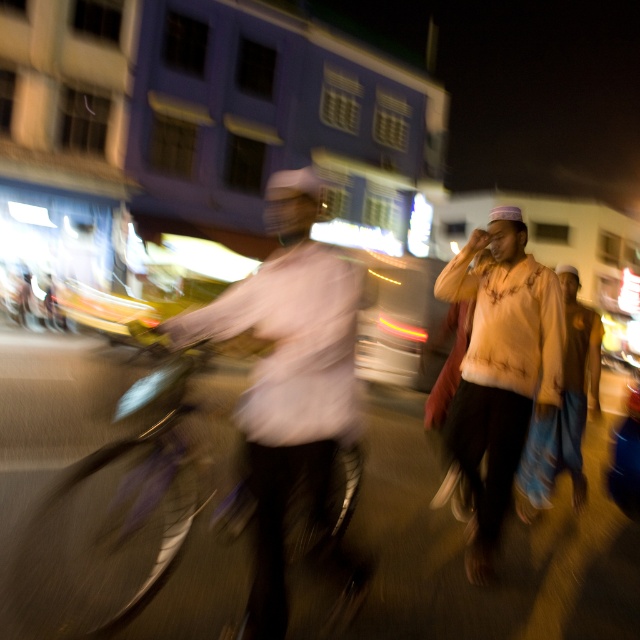
Does white matte shirt at center appear over light brown fabric shirt at center?

Yes.

Is white matte shirt at center to the right of light brown fabric shirt at center from the viewer's perspective?

Incorrect, white matte shirt at center is not on the right side of light brown fabric shirt at center.

Which is in front, point (308, 387) or point (536, 412)?

Point (308, 387) is in front.

The image size is (640, 640). In order to click on white matte shirt at center in this screenshot , I will do (x=291, y=392).

Between metallic silver bicycle at left and light brown fabric shirt at center, which one has more height?

light brown fabric shirt at center is taller.

Which is above, metallic silver bicycle at left or light brown fabric shirt at center?

light brown fabric shirt at center is above.

You are a GUI agent. You are given a task and a screenshot of the screen. Output one action in this format:
    pyautogui.click(x=<x>, y=<y>)
    Task: Click on the metallic silver bicycle at left
    
    Given the screenshot: What is the action you would take?
    pyautogui.click(x=128, y=512)

Is metallic silver bicycle at left below white matte shirt at center?

Yes, metallic silver bicycle at left is below white matte shirt at center.

Looking at this image, who is higher up, metallic silver bicycle at left or white matte shirt at center?

white matte shirt at center is higher up.

Does point (176, 522) come behind point (291, 372)?

Yes.

Locate an element on the screen. metallic silver bicycle at left is located at coordinates (128, 512).